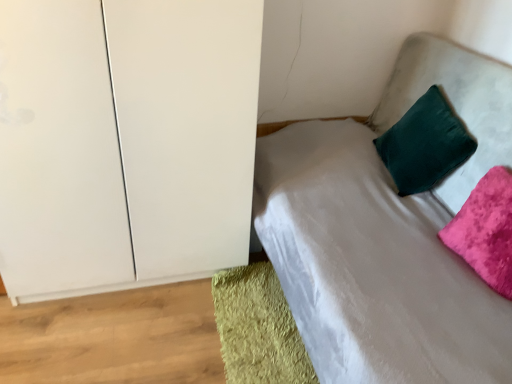
Question: From the image's perspective, would you say green shaggy rug at lower left is shown under velvet green pillow at upper right?

Choices:
 (A) yes
 (B) no

Answer: (A)

Question: Does green shaggy rug at lower left have a greater height compared to velvet green pillow at upper right?

Choices:
 (A) yes
 (B) no

Answer: (B)

Question: Is green shaggy rug at lower left thinner than velvet green pillow at upper right?

Choices:
 (A) no
 (B) yes

Answer: (B)

Question: From a real-world perspective, is green shaggy rug at lower left located higher than velvet green pillow at upper right?

Choices:
 (A) no
 (B) yes

Answer: (A)

Question: Is green shaggy rug at lower left with velvet green pillow at upper right?

Choices:
 (A) yes
 (B) no

Answer: (B)

Question: Can you confirm if green shaggy rug at lower left is positioned to the left of velvet green pillow at upper right?

Choices:
 (A) yes
 (B) no

Answer: (A)

Question: Is velvet green pillow at upper right, placed as the 1th pillow when sorted from back to front, behind white matte cabinet at left?

Choices:
 (A) yes
 (B) no

Answer: (A)

Question: Considering the relative sizes of velvet green pillow at upper right, placed as the 1th pillow when sorted from back to front, and white matte cabinet at left in the image provided, is velvet green pillow at upper right, placed as the 1th pillow when sorted from back to front, thinner than white matte cabinet at left?

Choices:
 (A) no
 (B) yes

Answer: (B)

Question: Is velvet green pillow at upper right, the second pillow positioned from the front, far from white matte cabinet at left?

Choices:
 (A) yes
 (B) no

Answer: (A)

Question: Is velvet green pillow at upper right, the second pillow positioned from the front, at the left side of white matte cabinet at left?

Choices:
 (A) yes
 (B) no

Answer: (B)

Question: Can you confirm if velvet green pillow at upper right, the second pillow positioned from the front, is smaller than white matte cabinet at left?

Choices:
 (A) no
 (B) yes

Answer: (B)

Question: Are velvet green pillow at upper right, the second pillow positioned from the front, and white matte cabinet at left making contact?

Choices:
 (A) yes
 (B) no

Answer: (B)

Question: Considering the relative sizes of green shaggy rug at lower left and velvet green pillow at upper right, placed as the 1th pillow when sorted from back to front, in the image provided, is green shaggy rug at lower left wider than velvet green pillow at upper right, placed as the 1th pillow when sorted from back to front,?

Choices:
 (A) yes
 (B) no

Answer: (A)